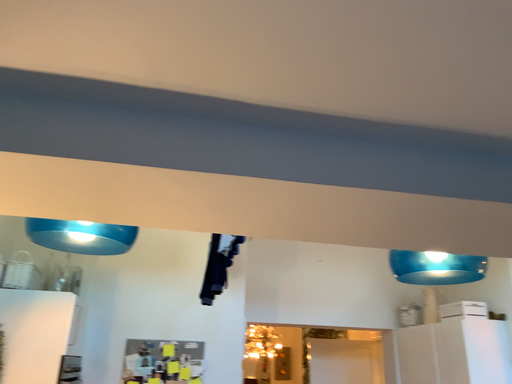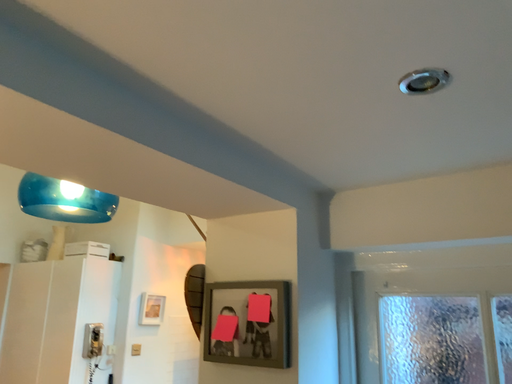
Question: Which way did the camera rotate in the video?

Choices:
 (A) rotated left
 (B) rotated right

Answer: (B)